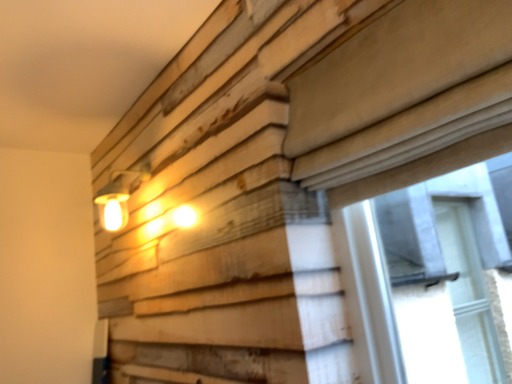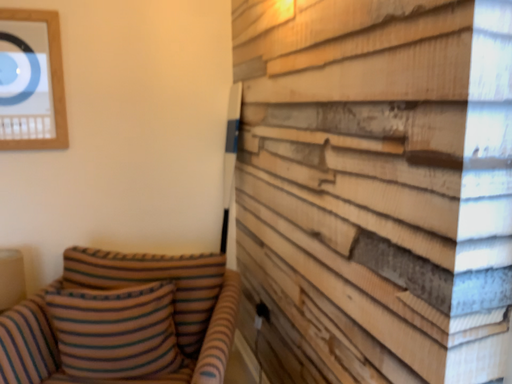
Question: How did the camera likely rotate when shooting the video?

Choices:
 (A) rotated right
 (B) rotated left

Answer: (B)